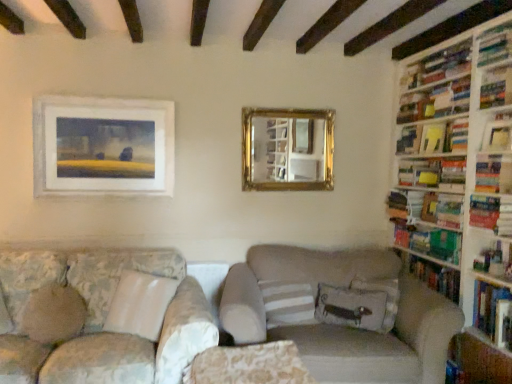
Question: Is hardcover book at upper right, positioned as the 1th book in top-to-bottom order, not within green matte bookshelf at right, the 2th book positioned from the bottom?

Choices:
 (A) no
 (B) yes

Answer: (B)

Question: Can you confirm if hardcover book at upper right, acting as the ninth book starting from the bottom, is wider than green matte bookshelf at right, the 2th book positioned from the bottom?

Choices:
 (A) yes
 (B) no

Answer: (B)

Question: Can you confirm if hardcover book at upper right, positioned as the 1th book in top-to-bottom order, is shorter than green matte bookshelf at right, the 2th book positioned from the bottom?

Choices:
 (A) no
 (B) yes

Answer: (B)

Question: Is hardcover book at upper right, positioned as the 1th book in top-to-bottom order, smaller than green matte bookshelf at right, the 2th book positioned from the bottom?

Choices:
 (A) no
 (B) yes

Answer: (B)

Question: Is hardcover book at upper right, acting as the ninth book starting from the bottom, looking in the opposite direction of green matte bookshelf at right, the 2th book positioned from the bottom?

Choices:
 (A) yes
 (B) no

Answer: (B)

Question: Is hardcover book at upper right, positioned as the 1th book in top-to-bottom order, far away from green matte bookshelf at right, the 2th book positioned from the bottom?

Choices:
 (A) no
 (B) yes

Answer: (B)

Question: From a real-world perspective, is green matte bookshelf at right, the 2th book positioned from the bottom, physically below white striped pillow at center, which is counted as the 2th pillow, starting from the right?

Choices:
 (A) yes
 (B) no

Answer: (B)

Question: Is green matte bookshelf at right, the 2th book positioned from the bottom, further to the viewer compared to white striped pillow at center, which is counted as the 2th pillow, starting from the right?

Choices:
 (A) no
 (B) yes

Answer: (B)

Question: Is white striped pillow at center, which is counted as the 2th pillow, starting from the right, located within green matte bookshelf at right, positioned as the 8th book in top-to-bottom order?

Choices:
 (A) no
 (B) yes

Answer: (A)

Question: Is green matte bookshelf at right, the 2th book positioned from the bottom, thinner than white striped pillow at center, which is counted as the 2th pillow, starting from the right?

Choices:
 (A) no
 (B) yes

Answer: (B)

Question: Is green matte bookshelf at right, positioned as the 8th book in top-to-bottom order, far away from white striped pillow at center, which is the second pillow from left to right?

Choices:
 (A) yes
 (B) no

Answer: (B)

Question: Can you confirm if green matte bookshelf at right, positioned as the 8th book in top-to-bottom order, is smaller than white striped pillow at center, which is the second pillow from left to right?

Choices:
 (A) no
 (B) yes

Answer: (B)

Question: Is the position of hardcover books at upper right, positioned as the 1th shelf in top-to-bottom order, less distant than that of green matte bookshelf at right, positioned as the 8th book in top-to-bottom order?

Choices:
 (A) no
 (B) yes

Answer: (B)